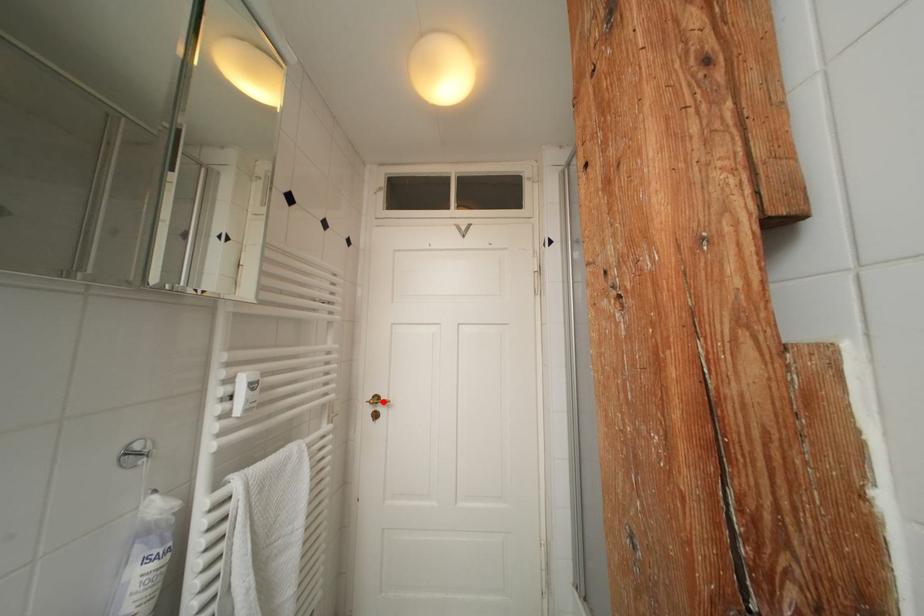
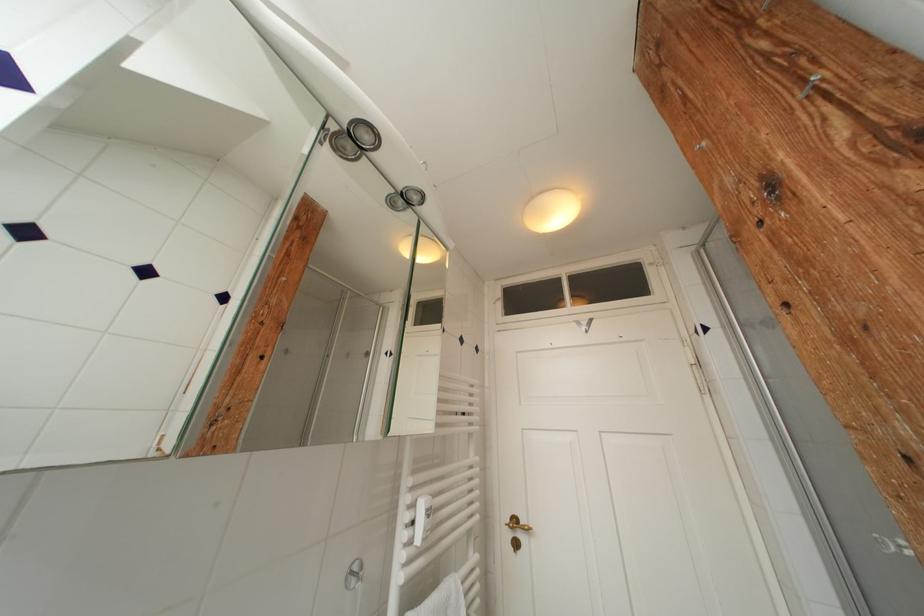
Where in the second image is the point corresponding to the highlighted location from the first image?

(521, 525)